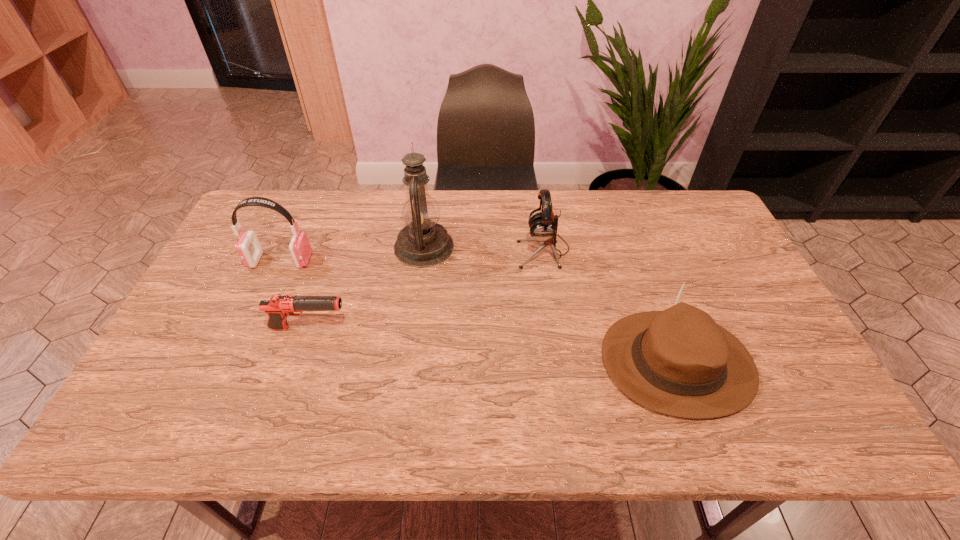
You are a GUI agent. You are given a task and a screenshot of the screen. Output one action in this format:
    pyautogui.click(x=<x>, y=<y>)
    Task: Click on the third object from left to right
    This screenshot has width=960, height=540.
    Given the screenshot: What is the action you would take?
    pyautogui.click(x=423, y=242)

Locate an element on the screen. The image size is (960, 540). oil lamp is located at coordinates (423, 242).

Locate an element on the screen. Image resolution: width=960 pixels, height=540 pixels. the second object from right to left is located at coordinates (543, 225).

The height and width of the screenshot is (540, 960). In order to click on the left earphone in this screenshot , I will do `click(248, 247)`.

Locate an element on the screen. Image resolution: width=960 pixels, height=540 pixels. the rightmost object is located at coordinates (679, 362).

Find the location of a particular element. The height and width of the screenshot is (540, 960). fedora is located at coordinates (679, 362).

The image size is (960, 540). I want to click on the shortest object, so coord(278,307).

Locate an element on the screen. vacant area situated on the left of the tallest object is located at coordinates 321,247.

Locate an element on the screen. The height and width of the screenshot is (540, 960). vacant space located 0.170m on the left of the second object from right to left is located at coordinates (463, 250).

At what (x,y) coordinates should I click in order to perform the action: click on vacant space located on the outer surface of the left earphone. Please return your answer as a coordinate pair (x, y). Looking at the image, I should click on (370, 261).